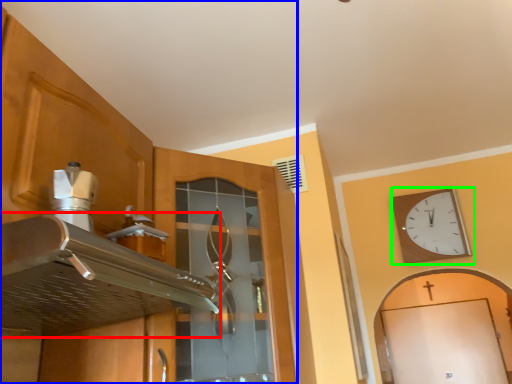
Question: Which object is positioned closest to exhaust hood (highlighted by a red box)? Select from cabinetry (highlighted by a blue box) and wall clock (highlighted by a green box).

Choices:
 (A) cabinetry
 (B) wall clock

Answer: (A)